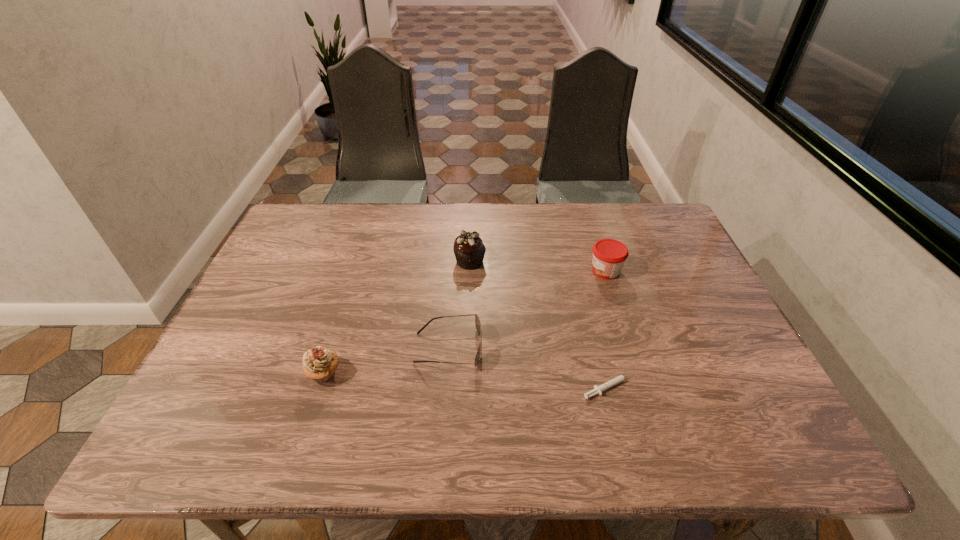
In order to click on free space that satisfies the following two spatial constraints: 1. on the front-facing side of the sunglasses; 2. on the left side of the shortest object in this screenshot , I will do `click(446, 387)`.

The image size is (960, 540). Identify the location of vacant space that satisfies the following two spatial constraints: 1. on the front-facing side of the syringe; 2. on the right side of the second shortest object. (446, 387).